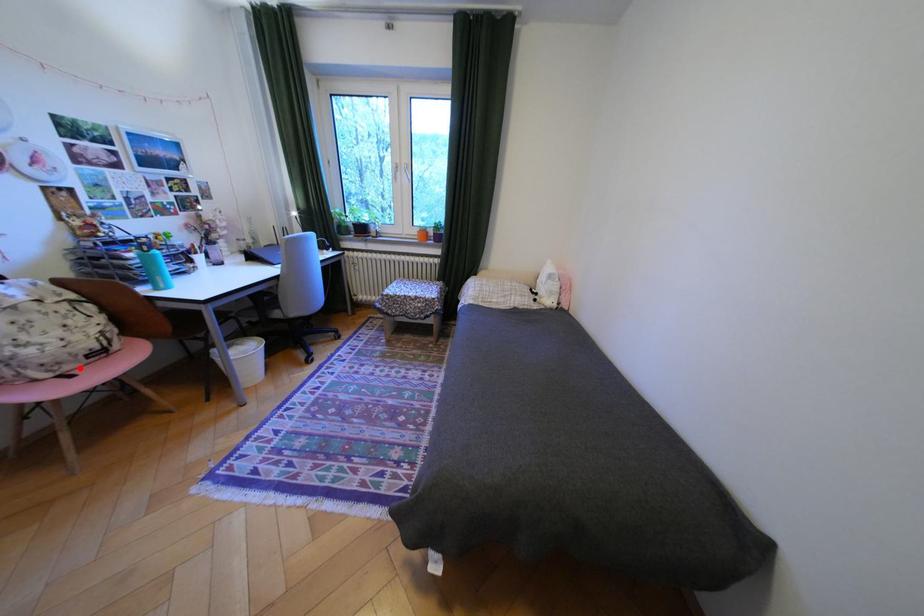
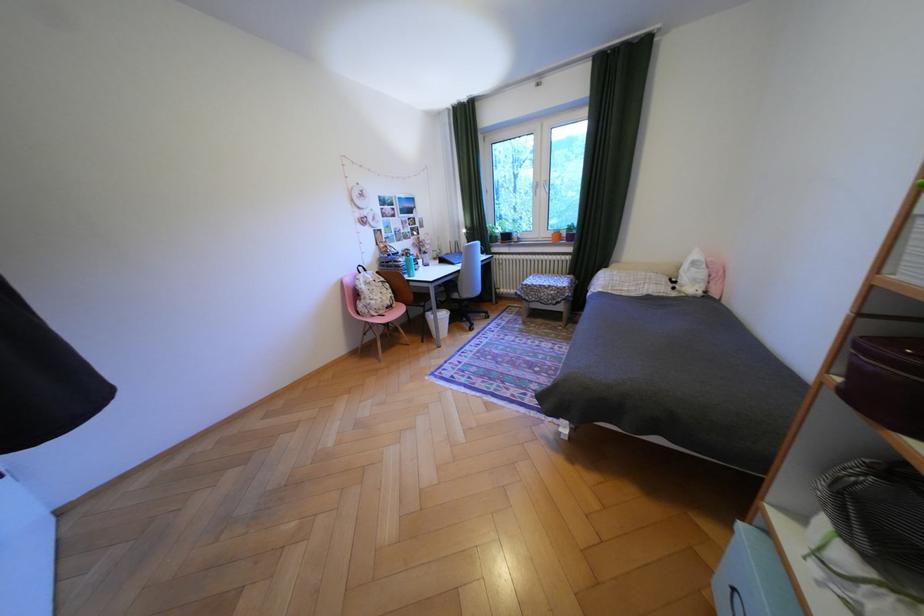
Find the pixel in the second image that matches the highlighted location in the first image.

(393, 312)